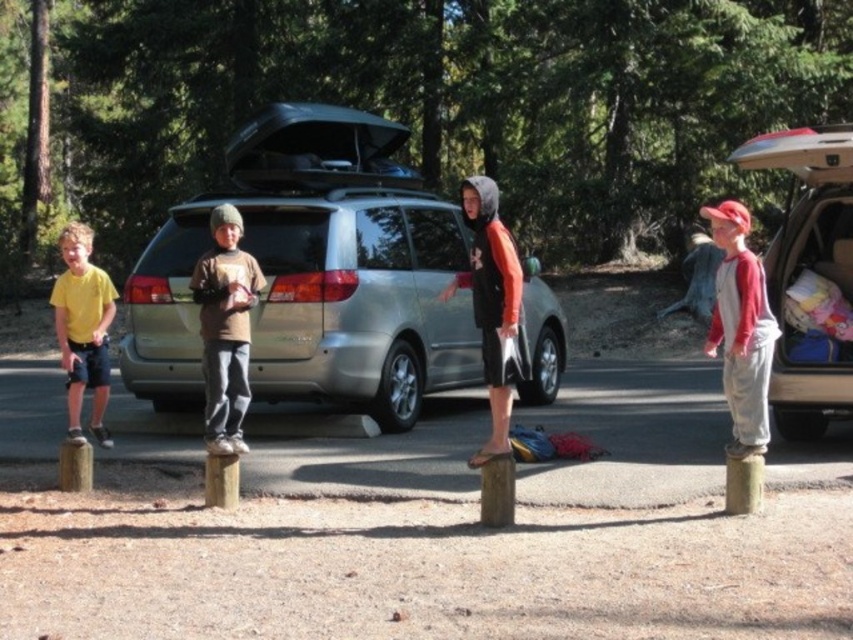
Question: Observing the image, what is the correct spatial positioning of silver metallic minivan at center in reference to yellow t-shirt at left?

Choices:
 (A) right
 (B) left

Answer: (A)

Question: Among these points, which one is nearest to the camera?

Choices:
 (A) (343, 397)
 (B) (94, 428)
 (C) (763, 310)
 (D) (253, 273)

Answer: (C)

Question: Is silver metallic minivan at center thinner than red and white baseball cap at right?

Choices:
 (A) yes
 (B) no

Answer: (A)

Question: Based on their relative distances, which object is farther from the silver metallic minivan at center?

Choices:
 (A) yellow t-shirt at left
 (B) brown cotton shirt at center
 (C) red and white baseball cap at right

Answer: (C)

Question: Which is farther from the silver metallic minivan at center?

Choices:
 (A) brown cotton shirt at center
 (B) red and white baseball cap at right
 (C) yellow t-shirt at left

Answer: (B)

Question: Can you confirm if silver metallic minivan at center is thinner than red and white baseball cap at right?

Choices:
 (A) yes
 (B) no

Answer: (A)